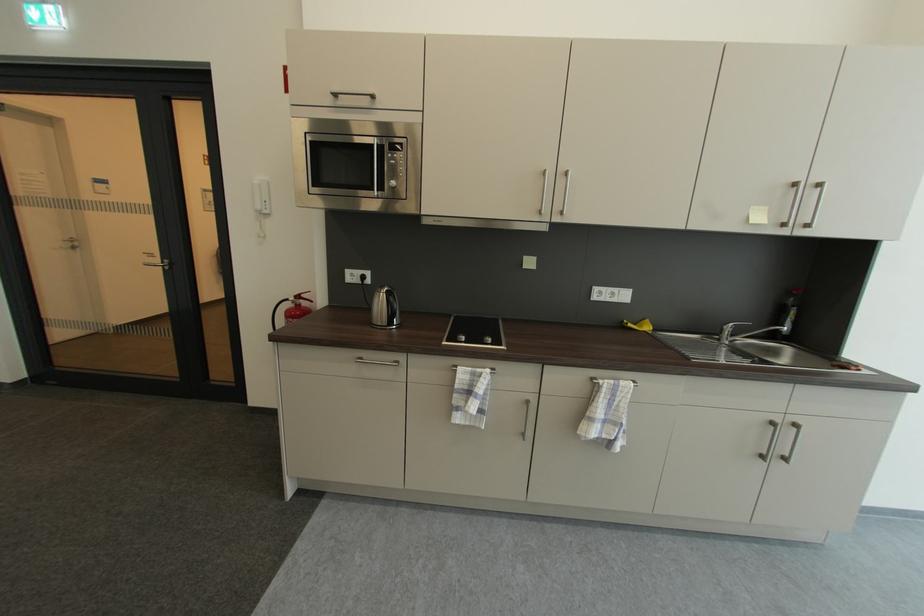
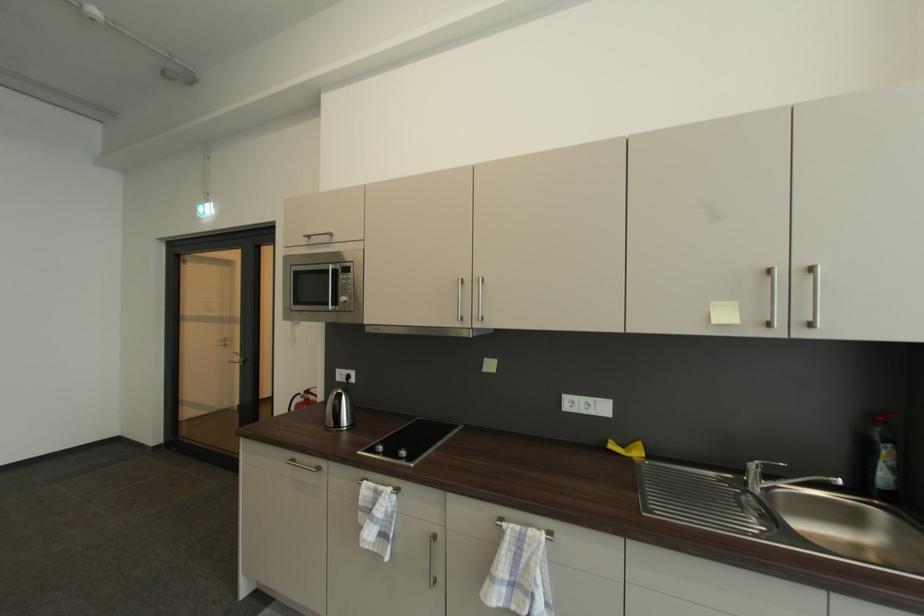
In the second image, find the point that corresponds to pixel 380 191 in the first image.

(334, 306)